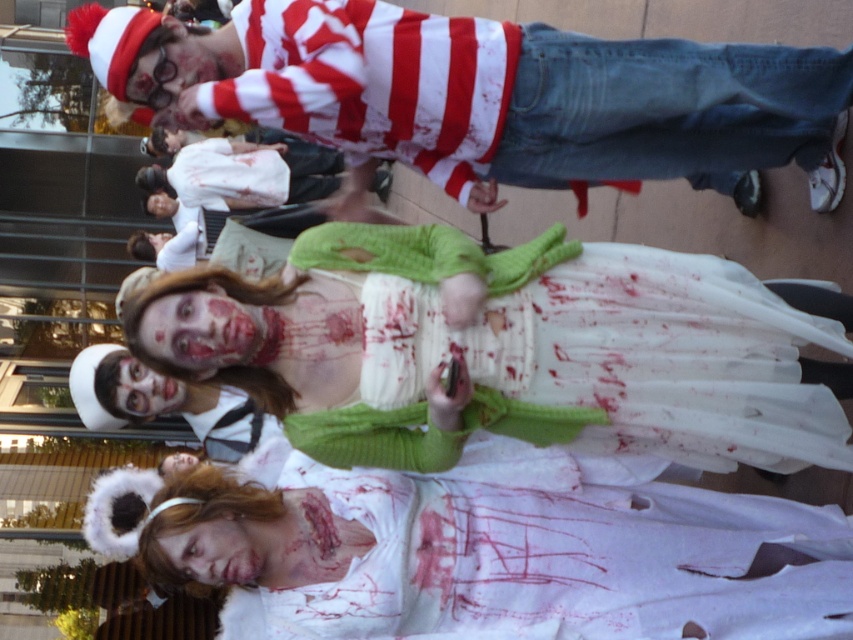
Question: From the image, what is the correct spatial relationship of white matte face at center in relation to matte plastic face at upper center?

Choices:
 (A) right
 (B) left

Answer: (A)

Question: Among these points, which one is farthest from the camera?

Choices:
 (A) (213, 40)
 (B) (219, 339)
 (C) (170, 196)
 (D) (621, 147)

Answer: (C)

Question: Is red and white striped shirt at upper center closer to camera compared to blood-stained fabric face at lower center?

Choices:
 (A) yes
 (B) no

Answer: (B)

Question: Which object is farther from the camera taking this photo?

Choices:
 (A) blood-stained fabric face at lower center
 (B) smooth skin face at center

Answer: (B)

Question: Which of the following is the farthest from the observer?

Choices:
 (A) (170, 540)
 (B) (218, 314)
 (C) (502, 92)

Answer: (C)

Question: Does white sheer dress at center appear under smooth skin face at center?

Choices:
 (A) yes
 (B) no

Answer: (A)